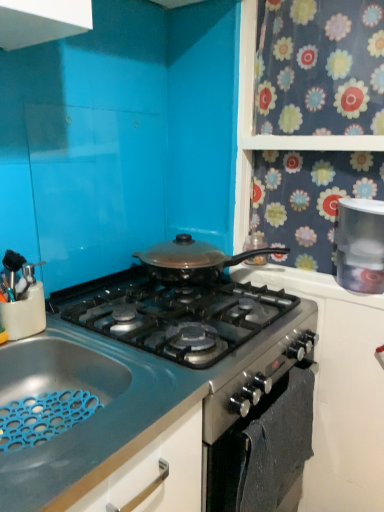
Question: Does blue rubber mat at lower left appear on the right side of satin black pan at center?

Choices:
 (A) no
 (B) yes

Answer: (A)

Question: Considering the relative sizes of blue rubber mat at lower left and satin black pan at center in the image provided, is blue rubber mat at lower left bigger than satin black pan at center?

Choices:
 (A) no
 (B) yes

Answer: (A)

Question: From the image's perspective, is blue rubber mat at lower left on satin black pan at center?

Choices:
 (A) yes
 (B) no

Answer: (B)

Question: Would you consider blue rubber mat at lower left to be distant from satin black pan at center?

Choices:
 (A) yes
 (B) no

Answer: (B)

Question: Is blue rubber mat at lower left further to camera compared to satin black pan at center?

Choices:
 (A) yes
 (B) no

Answer: (B)

Question: Is blue rubber mat at lower left next to satin black pan at center?

Choices:
 (A) no
 (B) yes

Answer: (A)

Question: Are white plastic container at upper right and satin black pan at center beside each other?

Choices:
 (A) no
 (B) yes

Answer: (A)

Question: Is white plastic container at upper right positioned beyond the bounds of satin black pan at center?

Choices:
 (A) no
 (B) yes

Answer: (B)

Question: Is white plastic container at upper right bigger than satin black pan at center?

Choices:
 (A) yes
 (B) no

Answer: (B)

Question: Is white plastic container at upper right not close to satin black pan at center?

Choices:
 (A) yes
 (B) no

Answer: (B)

Question: Is white plastic container at upper right facing away from satin black pan at center?

Choices:
 (A) yes
 (B) no

Answer: (B)

Question: Is satin black pan at center completely or partially inside white plastic container at upper right?

Choices:
 (A) yes
 (B) no

Answer: (B)

Question: Are white plastic container at upper right and satin silver oven at lower center located far from each other?

Choices:
 (A) no
 (B) yes

Answer: (A)